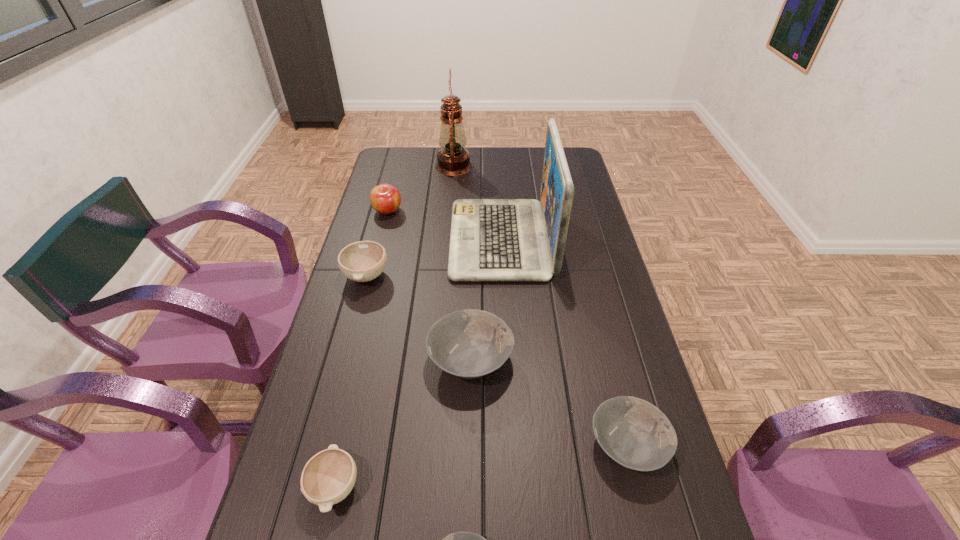
Identify the location of apple present at the left edge. This screenshot has height=540, width=960. (384, 198).

At what (x,y) coordinates should I click in order to perform the action: click on object located at the right edge. Please return your answer as a coordinate pair (x, y). The height and width of the screenshot is (540, 960). Looking at the image, I should click on (634, 433).

The width and height of the screenshot is (960, 540). What are the coordinates of `free point at the left edge` in the screenshot? It's located at (399, 233).

The height and width of the screenshot is (540, 960). In order to click on vacant position at the right edge of the desktop in this screenshot , I will do `click(582, 187)`.

Locate an element on the screen. The image size is (960, 540). vacant area at the far left corner of the desktop is located at coordinates point(396,157).

Image resolution: width=960 pixels, height=540 pixels. I want to click on free space at the far right corner, so click(x=575, y=165).

The image size is (960, 540). I want to click on unoccupied area between the laptop computer and the second smallest gray bowl, so click(564, 342).

The height and width of the screenshot is (540, 960). What are the coordinates of `free space between the second farthest gray bowl and the biggest gray bowl` in the screenshot? It's located at [549, 402].

Where is `unoccupied position between the laptop computer and the second farthest gray bowl`? This screenshot has width=960, height=540. unoccupied position between the laptop computer and the second farthest gray bowl is located at coordinates (564, 342).

This screenshot has height=540, width=960. Find the location of `unoccupied area between the nearer beige bowl and the apple`. unoccupied area between the nearer beige bowl and the apple is located at coordinates (361, 349).